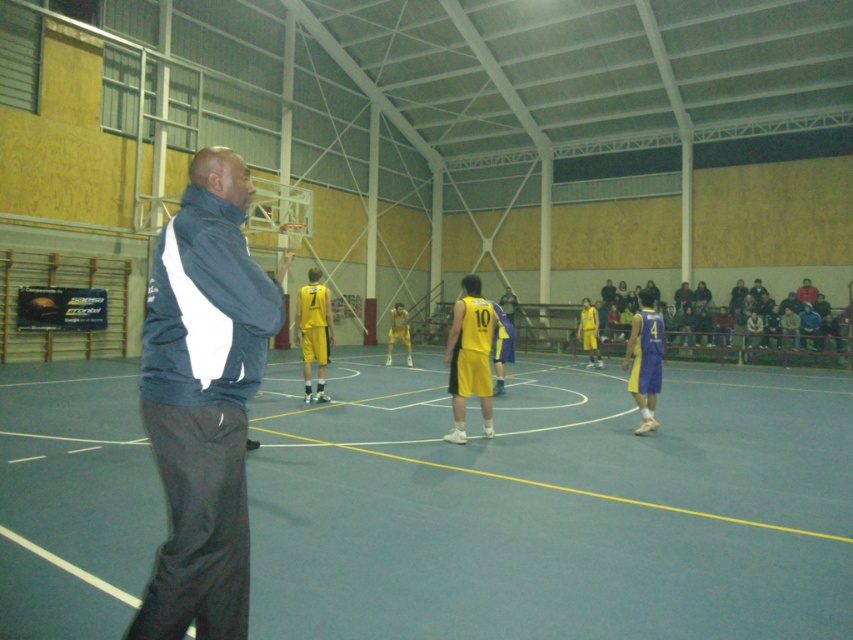
Which is more to the right, smooth gray court at center or yellow matte basketball player at center?

From the viewer's perspective, yellow matte basketball player at center appears more on the right side.

Which is below, smooth gray court at center or yellow matte basketball player at center?

Positioned lower is smooth gray court at center.

I want to click on smooth gray court at center, so 552,506.

At what (x,y) coordinates should I click in order to perform the action: click on smooth gray court at center. Please return your answer as a coordinate pair (x, y). This screenshot has height=640, width=853. Looking at the image, I should click on (552, 506).

Can you confirm if smooth gray court at center is wider than yellow jersey at center?

Yes.

Is smooth gray court at center further to the viewer compared to yellow jersey at center?

No, it is not.

You are a GUI agent. You are given a task and a screenshot of the screen. Output one action in this format:
    pyautogui.click(x=<x>, y=<y>)
    Task: Click on the smooth gray court at center
    The image size is (853, 640).
    Given the screenshot: What is the action you would take?
    pyautogui.click(x=552, y=506)

Who is positioned more to the left, blue jersey at center or yellow jersey at center?

From the viewer's perspective, yellow jersey at center appears more on the left side.

Does point (643, 310) lie behind point (294, 323)?

That is False.

Image resolution: width=853 pixels, height=640 pixels. I want to click on blue jersey at center, so click(645, 358).